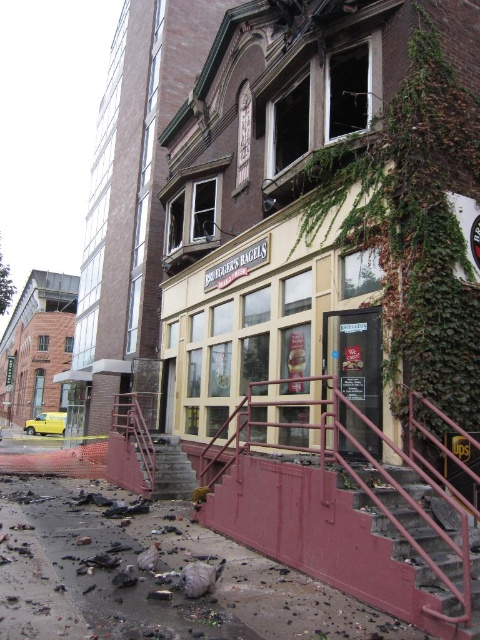
Question: Which of these objects is positioned closest to the rusty metal stairs at lower right?

Choices:
 (A) green ivy at upper right
 (B) concrete stairs at lower center
 (C) metallic red handrail at center

Answer: (C)

Question: Is green ivy at upper right in front of rusty metal stairs at lower right?

Choices:
 (A) yes
 (B) no

Answer: (B)

Question: Which point is closer to the camera taking this photo?

Choices:
 (A) (457, 605)
 (B) (158, 433)
 (C) (389, 547)
 (D) (425, 292)

Answer: (A)

Question: Can you confirm if green ivy at upper right is positioned above metallic red handrail at center?

Choices:
 (A) no
 (B) yes

Answer: (B)

Question: Is green ivy at upper right to the right of rusty metal stairs at lower right from the viewer's perspective?

Choices:
 (A) no
 (B) yes

Answer: (B)

Question: Among these points, which one is farthest from the camera?

Choices:
 (A) (230, 499)
 (B) (468, 172)

Answer: (B)